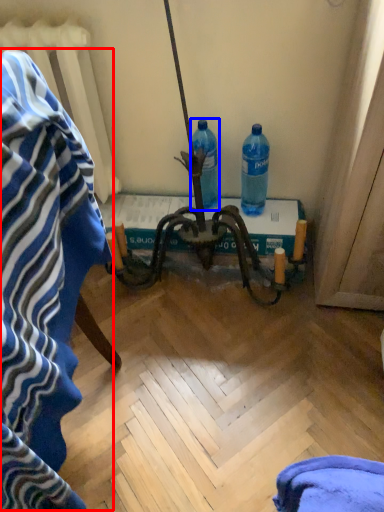
Question: Which object appears closest to the camera in this image, bath towel (highlighted by a red box) or bottle (highlighted by a blue box)?

Choices:
 (A) bath towel
 (B) bottle

Answer: (A)